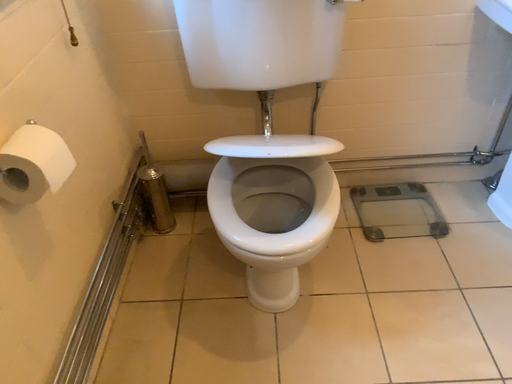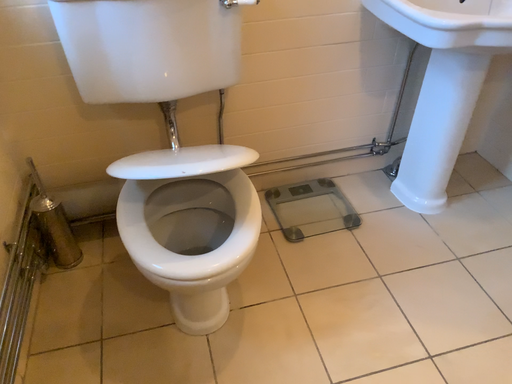
Question: How did the camera likely rotate when shooting the video?

Choices:
 (A) rotated left
 (B) rotated right

Answer: (B)